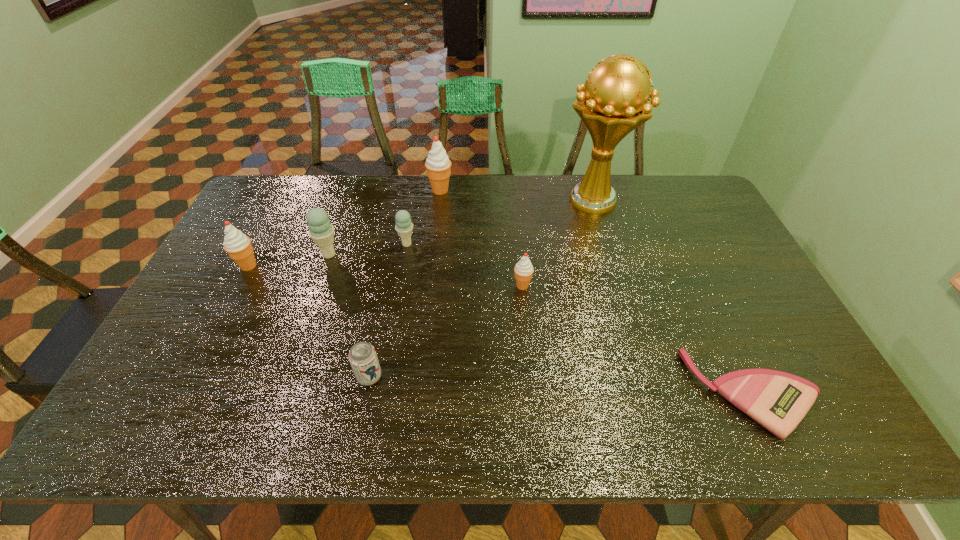
The width and height of the screenshot is (960, 540). I want to click on blank area located on the left of the nearest red icecream, so click(439, 286).

The height and width of the screenshot is (540, 960). In order to click on vacant area situated 0.190m on the back of the beer can in this screenshot , I will do `click(383, 306)`.

The width and height of the screenshot is (960, 540). I want to click on free space located 0.360m on the left of the wristlet, so click(x=536, y=393).

Image resolution: width=960 pixels, height=540 pixels. Find the location of `trophy_cup that is positioned at the far edge`. trophy_cup that is positioned at the far edge is located at coordinates (613, 101).

The image size is (960, 540). Identify the location of icecream that is at the far edge. (438, 165).

You are a GUI agent. You are given a task and a screenshot of the screen. Output one action in this format:
    pyautogui.click(x=<x>, y=<y>)
    Task: Click on the object that is positioned at the near edge
    
    Given the screenshot: What is the action you would take?
    pyautogui.click(x=778, y=401)

Where is `object present at the left edge`? object present at the left edge is located at coordinates (238, 246).

Find the location of a particular element. object that is at the right edge is located at coordinates (778, 401).

Find the location of `object present at the near right corner`. object present at the near right corner is located at coordinates (778, 401).

In the image, there is a desktop. What are the coordinates of `blank space at the far edge` in the screenshot? It's located at (506, 178).